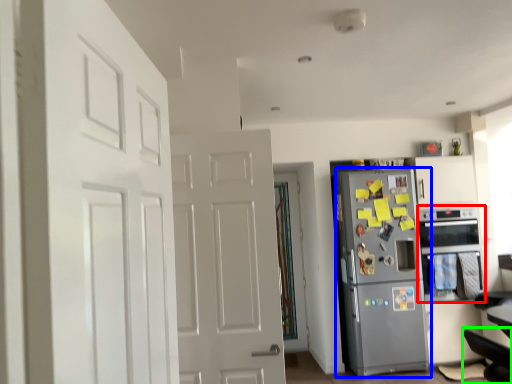
Question: Which object is the closest to the oven (highlighted by a red box)? Choose among these: refrigerator (highlighted by a blue box) or swivel chair (highlighted by a green box).

Choices:
 (A) refrigerator
 (B) swivel chair

Answer: (A)